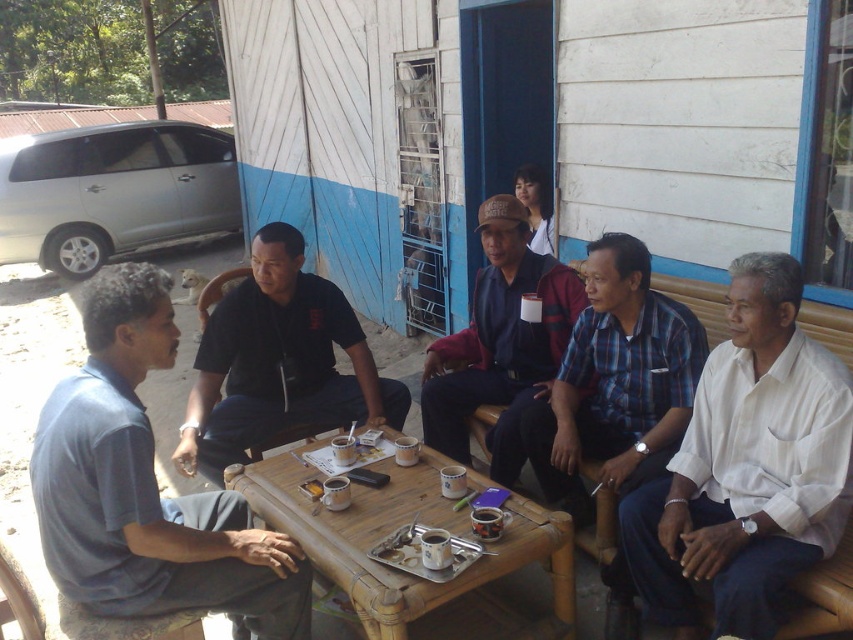
You are a photographer trying to capture a group photo of the blue cotton shirt at left and the dark blue fabric jacket at center. If you want to ensure both subjects are fully visible in the frame, which subject should you position closer to the camera to avoid cropping?

The blue cotton shirt at left should be positioned closer to the camera because it might be wider than the dark blue fabric jacket at center, ensuring both fit within the frame without cropping.

Looking at this image, you are sitting at the table and need to pass a document to the person wearing the black matte shirt at center. The document is currently on the table in front of the blue cotton shirt at left. Can you directly hand it to them without moving from your seat?

The blue cotton shirt at left is in front of the black matte shirt at center, so the person wearing the blue cotton shirt at left is closer to you. You can hand the document to the blue cotton shirt at left first, who can then pass it to the black matte shirt at center.

You are sitting at the bamboo table at center and want to hand a document to the person wearing the black matte shirt at center. In which direction should you pass the document?

The bamboo table at center is to the right of the black matte shirt at center, so you should pass the document to the left to reach them.